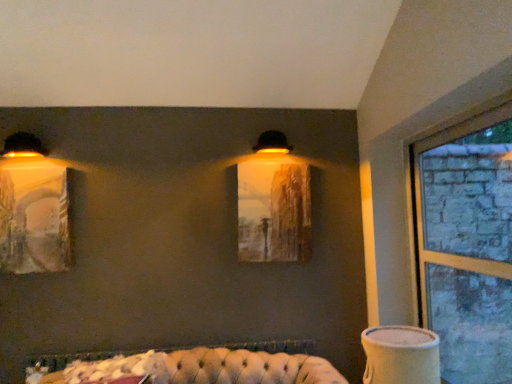
Question: Is matte glass painting at center positioned before matte yellow wall sconce at left, the 1th lamp viewed from the left?

Choices:
 (A) no
 (B) yes

Answer: (A)

Question: Is matte glass painting at center not inside matte yellow wall sconce at left, the second lamp from the bottom?

Choices:
 (A) yes
 (B) no

Answer: (A)

Question: Is matte yellow wall sconce at left, the 2th lamp viewed from the top, at the back of matte glass painting at center?

Choices:
 (A) yes
 (B) no

Answer: (B)

Question: Does matte glass painting at center appear on the left side of matte yellow wall sconce at left, which appears as the third lamp when viewed from the right?

Choices:
 (A) yes
 (B) no

Answer: (B)

Question: Is the surface of matte glass painting at center in direct contact with matte yellow wall sconce at left, the 2th lamp viewed from the top?

Choices:
 (A) no
 (B) yes

Answer: (A)

Question: Can you confirm if matte glass painting at center is positioned to the right of matte yellow wall sconce at left, the second lamp from the bottom?

Choices:
 (A) no
 (B) yes

Answer: (B)

Question: Is tufted leather couch at lower center bigger than matte glass painting at center?

Choices:
 (A) yes
 (B) no

Answer: (A)

Question: From a real-world perspective, is tufted leather couch at lower center below matte glass painting at center?

Choices:
 (A) no
 (B) yes

Answer: (B)

Question: Is tufted leather couch at lower center to the right of matte glass painting at center from the viewer's perspective?

Choices:
 (A) no
 (B) yes

Answer: (A)

Question: From the image's perspective, does tufted leather couch at lower center appear higher than matte glass painting at center?

Choices:
 (A) no
 (B) yes

Answer: (A)

Question: Does tufted leather couch at lower center have a greater height compared to matte glass painting at center?

Choices:
 (A) yes
 (B) no

Answer: (B)

Question: Is tufted leather couch at lower center at the left side of matte glass painting at center?

Choices:
 (A) no
 (B) yes

Answer: (B)

Question: From the image's perspective, is clear glass window at right beneath matte glass painting at center?

Choices:
 (A) yes
 (B) no

Answer: (A)